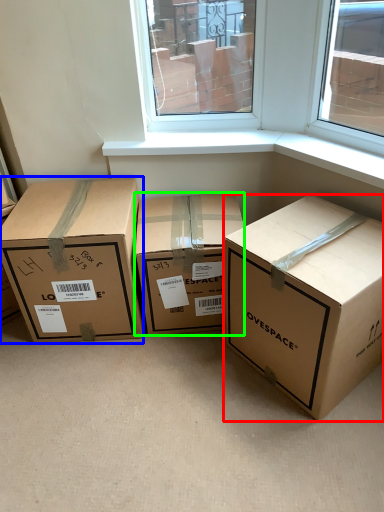
Question: Based on their relative distances, which object is farther from box (highlighted by a red box)? Choose from box (highlighted by a blue box) and box (highlighted by a green box).

Choices:
 (A) box
 (B) box

Answer: (A)